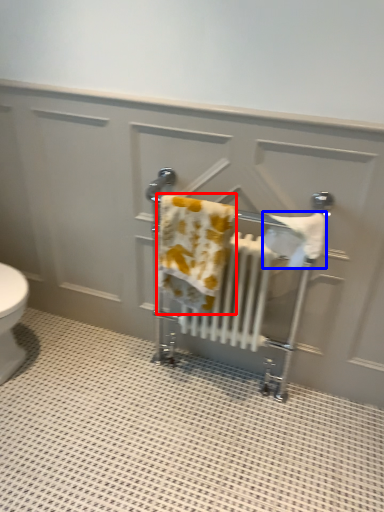
Question: Which point is closer to the camera, bath towel (highlighted by a red box) or bath towel (highlighted by a blue box)?

Choices:
 (A) bath towel
 (B) bath towel

Answer: (B)